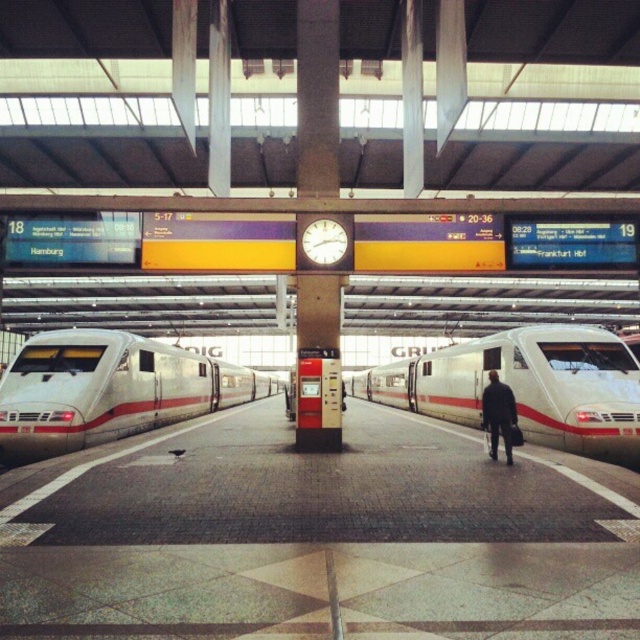
Question: Can you confirm if white glossy train at center is smaller than dark blue suit at center?

Choices:
 (A) no
 (B) yes

Answer: (A)

Question: Can you confirm if white glossy train at center is positioned to the right of dark blue suit at center?

Choices:
 (A) no
 (B) yes

Answer: (B)

Question: Among these objects, which one is nearest to the camera?

Choices:
 (A) silver metallic train at left
 (B) white glossy train at center

Answer: (B)

Question: Which of the following is the farthest from the observer?

Choices:
 (A) (132, 404)
 (B) (465, 406)

Answer: (B)

Question: Which point is closer to the camera taking this photo?

Choices:
 (A) (20, 374)
 (B) (500, 410)
 (C) (556, 403)

Answer: (B)

Question: Does white glossy train at center appear over silver metallic train at left?

Choices:
 (A) no
 (B) yes

Answer: (B)